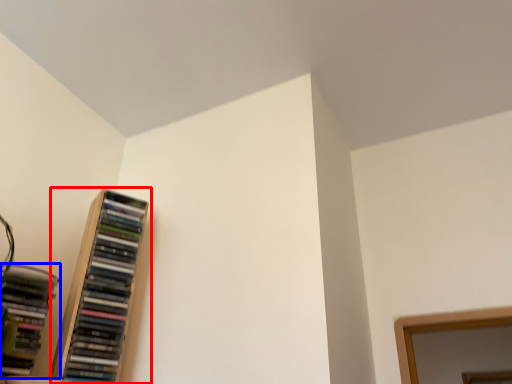
Question: Which of the following is the farthest to the observer, bookcase (highlighted by a red box) or book (highlighted by a blue box)?

Choices:
 (A) bookcase
 (B) book

Answer: (A)